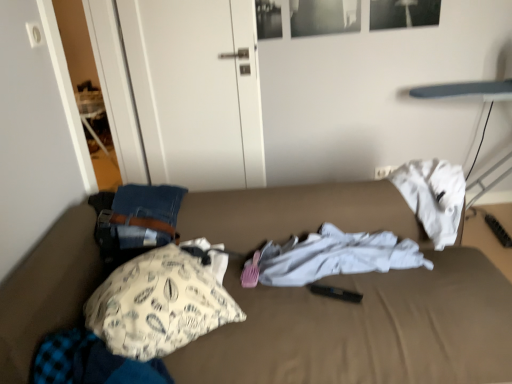
Describe the element at coordinates (335, 256) in the screenshot. I see `white cotton shirt at center, the 1th clothing positioned from the back` at that location.

What are the coordinates of `white printed fabric pillow at left` in the screenshot? It's located at (x=158, y=304).

What do you see at coordinates (196, 90) in the screenshot?
I see `white matte door at upper left` at bounding box center [196, 90].

What are the coordinates of `white cotton shirt at center, placed as the second clothing when sorted from front to back` in the screenshot? It's located at (335, 256).

Locate an element on the screen. bed that is on the right side of white matte door at upper left is located at coordinates (347, 303).

Is brown fabric bed at center bigger than white matte door at upper left?

Correct, brown fabric bed at center is larger in size than white matte door at upper left.

Are brown fabric bed at center and white matte door at upper left located far from each other?

Yes, brown fabric bed at center and white matte door at upper left are quite far apart.

Which object is positioned more to the right, brown fabric bed at center or white matte door at upper left?

brown fabric bed at center is more to the right.

Between brown fabric bed at center and white printed fabric pillow at left, which one has smaller width?

white printed fabric pillow at left is thinner.

In the scene shown: From the image's perspective, which is below, brown fabric bed at center or white printed fabric pillow at left?

brown fabric bed at center, from the image's perspective.

From a real-world perspective, is brown fabric bed at center positioned above or below white printed fabric pillow at left?

From a real-world perspective, brown fabric bed at center is physically below white printed fabric pillow at left.

From the image's perspective, would you say white cotton shirt at center, which ranks as the second clothing in left-to-right order, is shown under white matte door at upper left?

Yes.

Can you confirm if white cotton shirt at center, the 1th clothing in the top-to-bottom sequence, is smaller than white matte door at upper left?

Yes, white cotton shirt at center, the 1th clothing in the top-to-bottom sequence, is smaller than white matte door at upper left.

Consider the image. What's the angular difference between white cotton shirt at center, the 1th clothing positioned from the back, and white matte door at upper left's facing directions?

17.9 degrees.

Is white printed fabric pillow at left positioned far away from white matte door at upper left?

Yes, white printed fabric pillow at left and white matte door at upper left are quite far apart.

Considering the relative sizes of white printed fabric pillow at left and white matte door at upper left in the image provided, is white printed fabric pillow at left wider than white matte door at upper left?

Yes.

Consider the image. Can you confirm if white printed fabric pillow at left is shorter than white matte door at upper left?

Indeed, white printed fabric pillow at left has a lesser height compared to white matte door at upper left.

The width and height of the screenshot is (512, 384). Find the location of `door above the white printed fabric pillow at left (from the image's perspective)`. door above the white printed fabric pillow at left (from the image's perspective) is located at coordinates (196, 90).

Are white printed fabric pillow at left and brown fabric bed at center making contact?

They are not placed beside each other.

Based on the photo, visually, is white printed fabric pillow at left positioned to the left or to the right of brown fabric bed at center?

white printed fabric pillow at left is positioned on brown fabric bed at center's left side.

Who is bigger, white printed fabric pillow at left or brown fabric bed at center?

With larger size is brown fabric bed at center.

The width and height of the screenshot is (512, 384). What are the coordinates of `pillow that appears above the brown fabric bed at center (from a real-world perspective)` in the screenshot? It's located at (158, 304).

Which point is more distant from viewer, [102,310] or [332,263]?

Point [332,263]

Is white printed fabric pillow at left oriented away from white cotton shirt at center, which ranks as the second clothing in left-to-right order?

No.

Is white printed fabric pillow at left far away from white cotton shirt at center, the 1th clothing positioned from the back?

That's not correct — white printed fabric pillow at left is a little close to white cotton shirt at center, the 1th clothing positioned from the back.

Considering the sizes of objects white printed fabric pillow at left and white cotton shirt at center, the 1th clothing in the top-to-bottom sequence, in the image provided, who is shorter, white printed fabric pillow at left or white cotton shirt at center, the 1th clothing in the top-to-bottom sequence,?

white cotton shirt at center, the 1th clothing in the top-to-bottom sequence, is shorter.

Is white cotton shirt at center, the 1th clothing positioned from the back, inside or outside of brown fabric bed at center?

white cotton shirt at center, the 1th clothing positioned from the back, is inside brown fabric bed at center.

Between white cotton shirt at center, the 1th clothing positioned from the back, and brown fabric bed at center, which one is positioned in front?

brown fabric bed at center is in front.

Considering the relative sizes of white cotton shirt at center, the 1th clothing in the top-to-bottom sequence, and brown fabric bed at center in the image provided, is white cotton shirt at center, the 1th clothing in the top-to-bottom sequence, wider than brown fabric bed at center?

No.

From the image's perspective, which one is positioned higher, white cotton shirt at center, the second clothing when ordered from bottom to top, or brown fabric bed at center?

white cotton shirt at center, the second clothing when ordered from bottom to top, is shown above in the image.

You are a GUI agent. You are given a task and a screenshot of the screen. Output one action in this format:
    pyautogui.click(x=<x>, y=<y>)
    Task: Click on the door lying behind the brown fabric bed at center
    The height and width of the screenshot is (384, 512).
    Given the screenshot: What is the action you would take?
    pyautogui.click(x=196, y=90)

You are a GUI agent. You are given a task and a screenshot of the screen. Output one action in this format:
    pyautogui.click(x=<x>, y=<y>)
    Task: Click on the bed below the white printed fabric pillow at left (from a real-world perspective)
    This screenshot has width=512, height=384.
    Given the screenshot: What is the action you would take?
    pyautogui.click(x=347, y=303)

Estimate the real-world distances between objects in this image. Which object is further from white matte door at upper left, white cotton shirt at center, the 1th clothing positioned from the back, or white printed fabric pillow at left?

white printed fabric pillow at left is positioned further to the anchor white matte door at upper left.

Looking at the image, which one is located further to fluffy blue blanket at lower left, the 1th clothing in the bottom-to-top sequence, white cotton shirt at center, the 1th clothing positioned from the back, or white printed fabric pillow at left?

white cotton shirt at center, the 1th clothing positioned from the back.

In the scene shown: From the image, which object appears to be nearer to white matte door at upper left, white printed fabric pillow at left or brown fabric bed at center?

brown fabric bed at center is closer to white matte door at upper left.

Considering their positions, is fluffy blue blanket at lower left, positioned as the second clothing in top-to-bottom order, positioned further to white matte door at upper left than white cotton shirt at center, the 1th clothing positioned from the back?

The object further to white matte door at upper left is fluffy blue blanket at lower left, positioned as the second clothing in top-to-bottom order.

Estimate the real-world distances between objects in this image. Which object is closer to fluffy blue blanket at lower left, which is the second clothing in right-to-left order, white matte door at upper left or white cotton shirt at center, which ranks as the second clothing in left-to-right order?

white cotton shirt at center, which ranks as the second clothing in left-to-right order, lies closer to fluffy blue blanket at lower left, which is the second clothing in right-to-left order, than the other object.

Looking at this image, which object lies further to the anchor point fluffy blue blanket at lower left, which is the second clothing in right-to-left order, white cotton shirt at center, the second clothing when ordered from bottom to top, or brown fabric bed at center?

white cotton shirt at center, the second clothing when ordered from bottom to top.

Looking at the image, which one is located further to white matte door at upper left, brown fabric bed at center or white cotton shirt at center, positioned as the 1th clothing in right-to-left order?

white cotton shirt at center, positioned as the 1th clothing in right-to-left order, lies further to white matte door at upper left than the other object.

Estimate the real-world distances between objects in this image. Which object is closer to white cotton shirt at center, the 1th clothing positioned from the back, brown fabric bed at center or white matte door at upper left?

brown fabric bed at center lies closer to white cotton shirt at center, the 1th clothing positioned from the back, than the other object.

The width and height of the screenshot is (512, 384). I want to click on pillow located between brown fabric bed at center and white matte door at upper left in the depth direction, so click(158, 304).

In order to click on bed between white printed fabric pillow at left and white cotton shirt at center, which ranks as the second clothing in left-to-right order, in the horizontal direction in this screenshot , I will do `click(347, 303)`.

At what (x,y) coordinates should I click in order to perform the action: click on pillow situated between fluffy blue blanket at lower left, the 1th clothing in the left-to-right sequence, and white cotton shirt at center, which ranks as the second clothing in left-to-right order, from left to right. Please return your answer as a coordinate pair (x, y). Looking at the image, I should click on (158, 304).

Where is `clothing between fluffy blue blanket at lower left, placed as the first clothing when sorted from front to back, and white matte door at upper left from front to back`? Image resolution: width=512 pixels, height=384 pixels. clothing between fluffy blue blanket at lower left, placed as the first clothing when sorted from front to back, and white matte door at upper left from front to back is located at coordinates coord(335,256).